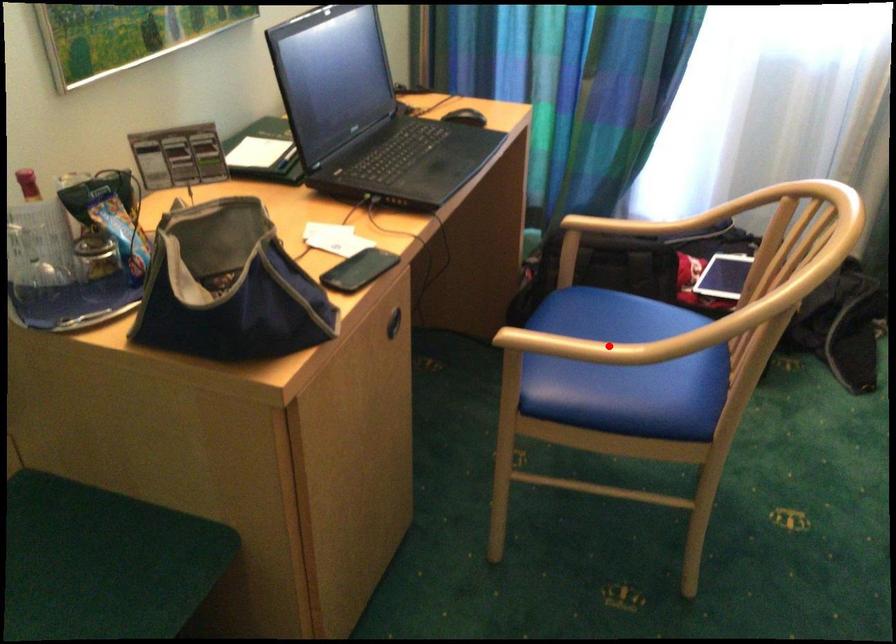
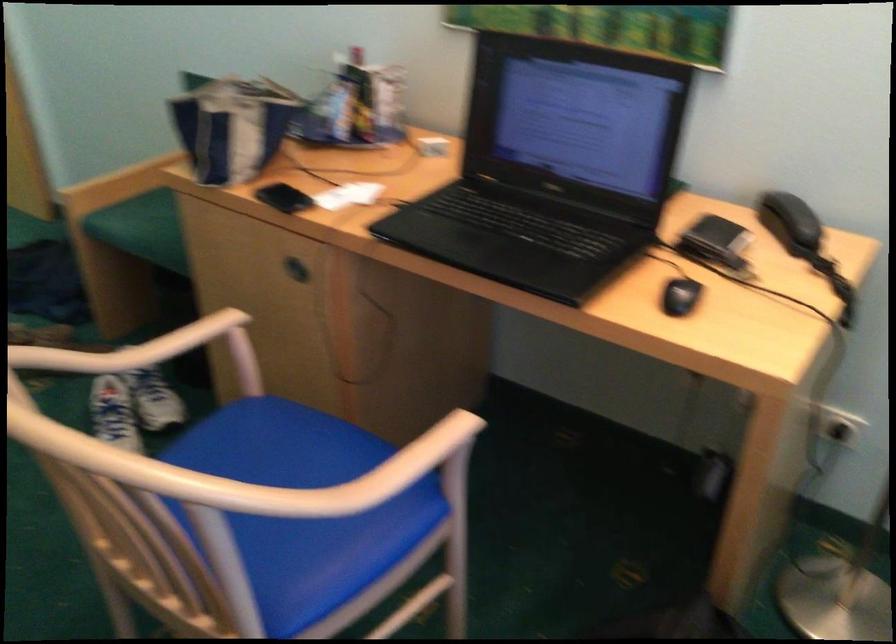
Question: I am providing you with two images of the same scene from different viewpoints. A red point is shown in image1. For the corresponding object point in image2, is it positioned nearer or farther from the camera?

Choices:
 (A) Nearer
 (B) Farther

Answer: (B)